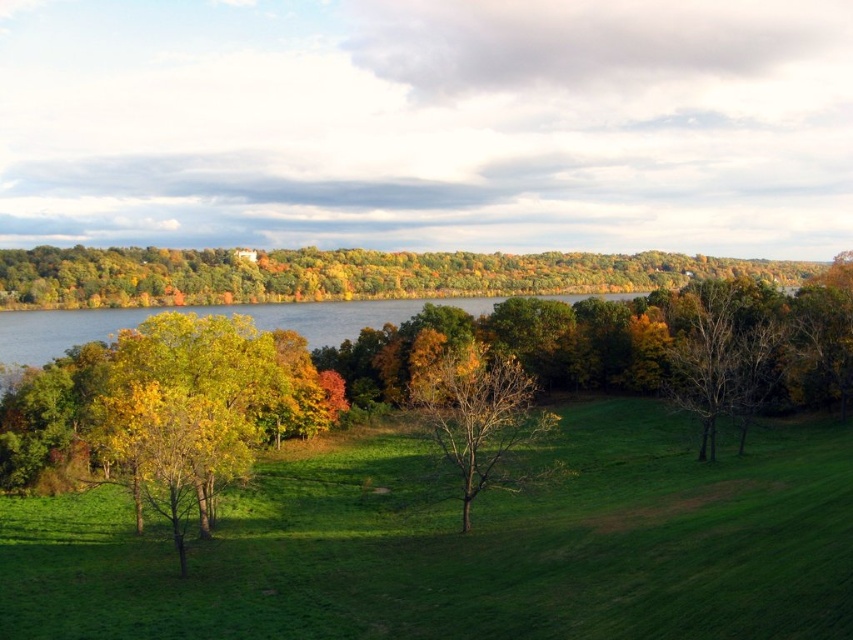
Is green leafy tree at upper center bigger than bare branches at center right?

Yes, green leafy tree at upper center is bigger than bare branches at center right.

Which is behind, point (233, 292) or point (743, 316)?

Positioned behind is point (233, 292).

Identify the location of green leafy tree at upper center. This screenshot has width=853, height=640. (344, 275).

The image size is (853, 640). I want to click on green leafy tree at upper center, so click(344, 275).

Does green leafy tree at upper center have a lesser height compared to green water at center?

No, green leafy tree at upper center is not shorter than green water at center.

Is point (67, 266) closer to viewer compared to point (48, 317)?

No.

Identify the location of green leafy tree at upper center. The image size is (853, 640). (344, 275).

Does green leafy tree at upper center have a greater width compared to brown leafless tree at center?

Indeed, green leafy tree at upper center has a greater width compared to brown leafless tree at center.

This screenshot has height=640, width=853. Describe the element at coordinates (344, 275) in the screenshot. I see `green leafy tree at upper center` at that location.

I want to click on green leafy tree at upper center, so click(x=344, y=275).